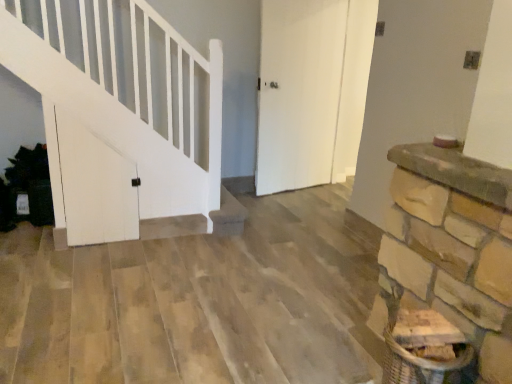
Question: Considering the relative positions of white matte door at center, the second door positioned from the front, and white matte door at left, the 2th door from the back, in the image provided, is white matte door at center, the second door positioned from the front, in front of white matte door at left, the 2th door from the back,?

Choices:
 (A) no
 (B) yes

Answer: (A)

Question: Is white matte door at center, the second door positioned from the front, at the left side of white matte door at left, the 2th door from the right?

Choices:
 (A) yes
 (B) no

Answer: (B)

Question: Is white matte door at center, the 1th door positioned from the right, positioned with its back to white matte door at left, the 2th door from the right?

Choices:
 (A) yes
 (B) no

Answer: (B)

Question: Is white matte door at center, the second door positioned from the front, shorter than white matte door at left, the 1th door positioned from the front?

Choices:
 (A) yes
 (B) no

Answer: (B)

Question: Considering the relative sizes of white matte door at center, the 1th door viewed from the back, and white matte door at left, the 1th door positioned from the front, in the image provided, is white matte door at center, the 1th door viewed from the back, thinner than white matte door at left, the 1th door positioned from the front,?

Choices:
 (A) yes
 (B) no

Answer: (B)

Question: Is white matte door at center, the second door positioned from the front, directly adjacent to white matte door at left, the 2th door from the back?

Choices:
 (A) yes
 (B) no

Answer: (B)

Question: Does white matte door at left, the 2th door from the right, come behind white matte door at center, which is the 2th door in left-to-right order?

Choices:
 (A) no
 (B) yes

Answer: (A)

Question: From a real-world perspective, is white matte door at left, the 2th door from the right, over white matte door at center, the 1th door viewed from the back?

Choices:
 (A) no
 (B) yes

Answer: (A)

Question: Is white matte door at left, the 1th door positioned from the front, aimed at white matte door at center, the 1th door viewed from the back?

Choices:
 (A) yes
 (B) no

Answer: (B)

Question: From the image's perspective, would you say white matte door at left, the 1th door when ordered from left to right, is shown under white matte door at center, the second door positioned from the front?

Choices:
 (A) no
 (B) yes

Answer: (B)

Question: Can you confirm if white matte door at left, the 2th door from the back, is thinner than white matte door at center, the second door positioned from the front?

Choices:
 (A) yes
 (B) no

Answer: (A)

Question: From a real-world perspective, relative to white matte door at center, which is the 2th door in left-to-right order, is white matte door at left, the 2th door from the right, vertically above or below?

Choices:
 (A) below
 (B) above

Answer: (A)